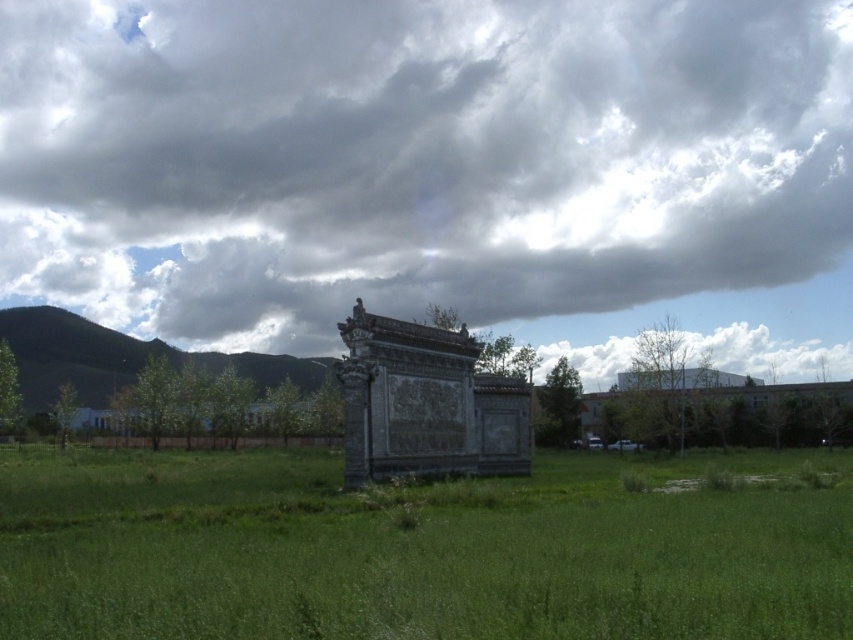
You are an archaeologist examining the image. You need to determine which object takes up more area in the image between the dark gray stone monument at center and the green grassy hill at left. Which one is it?

The green grassy hill at left occupies more space than the dark gray stone monument at center according to the description.